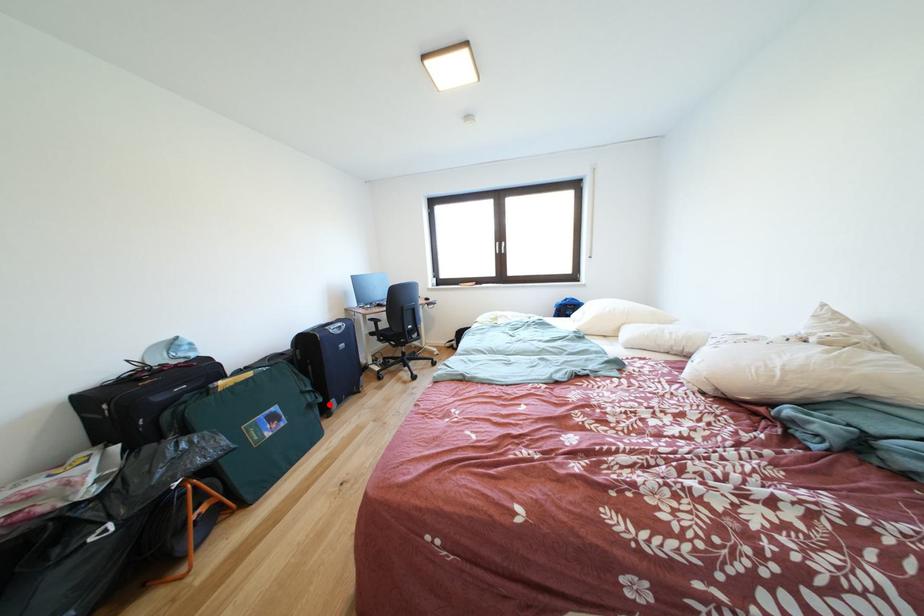
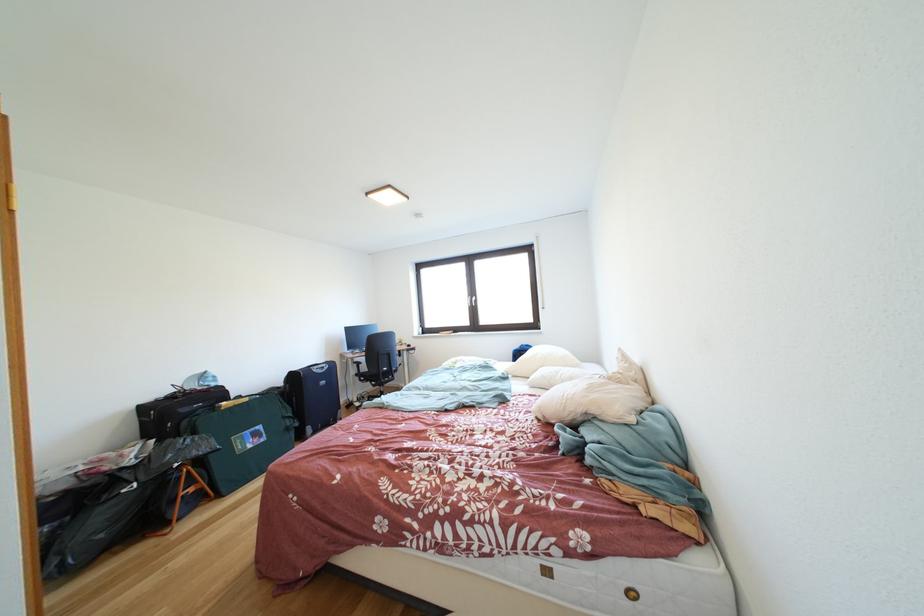
Locate, in the second image, the point that corresponds to the highlighted location in the first image.

(306, 429)